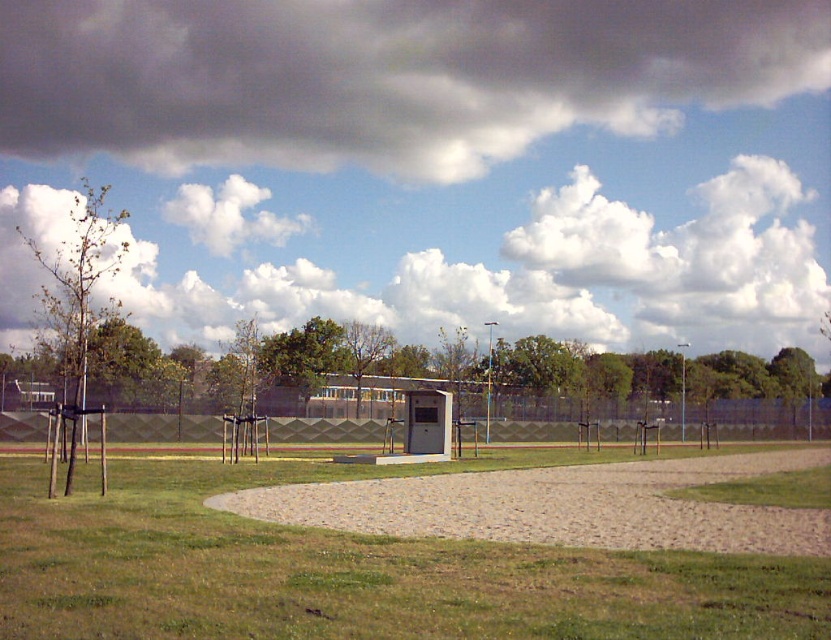
You are standing at the point marked by the coordinates point (348,572) in the image. Based on the scene described, what is the immediate surface you would be standing on?

The point (348,572) marks green grass at center, so you would be standing on green grass at center.